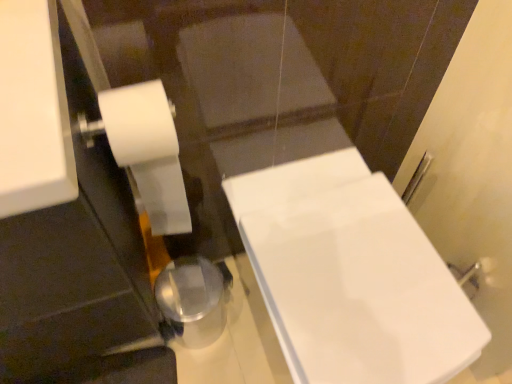
Question: Is white matte toilet paper at left to the left of white glossy bathtub at center from the viewer's perspective?

Choices:
 (A) no
 (B) yes

Answer: (B)

Question: Considering the relative sizes of white matte toilet paper at left and white glossy bathtub at center in the image provided, is white matte toilet paper at left bigger than white glossy bathtub at center?

Choices:
 (A) no
 (B) yes

Answer: (A)

Question: Is white matte toilet paper at left next to white glossy bathtub at center and touching it?

Choices:
 (A) yes
 (B) no

Answer: (B)

Question: From a real-world perspective, is white matte toilet paper at left below white glossy bathtub at center?

Choices:
 (A) no
 (B) yes

Answer: (A)

Question: Is white glossy bathtub at center completely or partially inside white matte toilet paper at left?

Choices:
 (A) no
 (B) yes

Answer: (A)

Question: Does white matte toilet paper at left appear on the right side of white glossy bathtub at center?

Choices:
 (A) yes
 (B) no

Answer: (B)

Question: Does white glossy bathtub at center appear on the right side of white matte toilet paper at left?

Choices:
 (A) no
 (B) yes

Answer: (B)

Question: Is white glossy bathtub at center to the left of white matte toilet paper at left from the viewer's perspective?

Choices:
 (A) yes
 (B) no

Answer: (B)

Question: Is white glossy bathtub at center surrounding white matte toilet paper at left?

Choices:
 (A) no
 (B) yes

Answer: (A)

Question: Is there a large distance between white glossy bathtub at center and white matte toilet paper at left?

Choices:
 (A) no
 (B) yes

Answer: (A)

Question: Is white glossy bathtub at center aimed at white matte toilet paper at left?

Choices:
 (A) yes
 (B) no

Answer: (B)

Question: Considering the relative sizes of white glossy bathtub at center and white matte toilet paper at left in the image provided, is white glossy bathtub at center bigger than white matte toilet paper at left?

Choices:
 (A) yes
 (B) no

Answer: (A)

Question: Looking at the image, does white matte toilet paper at left seem bigger or smaller compared to white glossy bathtub at center?

Choices:
 (A) small
 (B) big

Answer: (A)